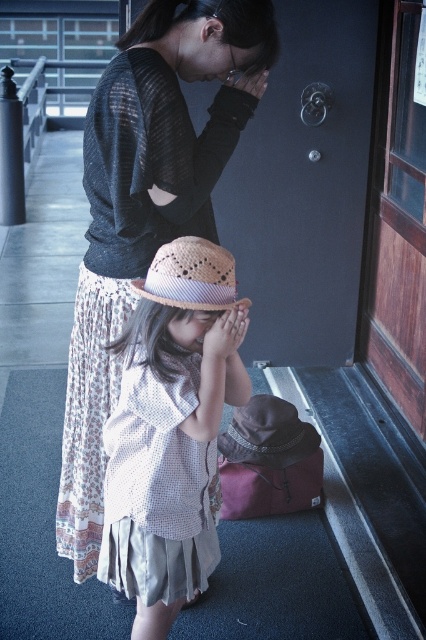
Question: Can you confirm if white textured shirt at center is positioned to the right of natural straw hat at lower center?

Choices:
 (A) yes
 (B) no

Answer: (B)

Question: Is natural straw hat at center closer to the viewer compared to natural straw hat at lower center?

Choices:
 (A) no
 (B) yes

Answer: (B)

Question: Which of the following is the farthest from the observer?

Choices:
 (A) (180, 250)
 (B) (262, 436)
 (C) (170, 532)

Answer: (B)

Question: Which object is closer to the camera taking this photo?

Choices:
 (A) natural straw hat at center
 (B) natural straw hat at lower center
 (C) white textured shirt at center
 (D) matte black sweater at upper center

Answer: (A)

Question: Is white textured shirt at center thinner than natural straw hat at center?

Choices:
 (A) no
 (B) yes

Answer: (A)

Question: Among these objects, which one is nearest to the camera?

Choices:
 (A) white textured shirt at center
 (B) natural straw hat at lower center
 (C) matte black sweater at upper center

Answer: (A)